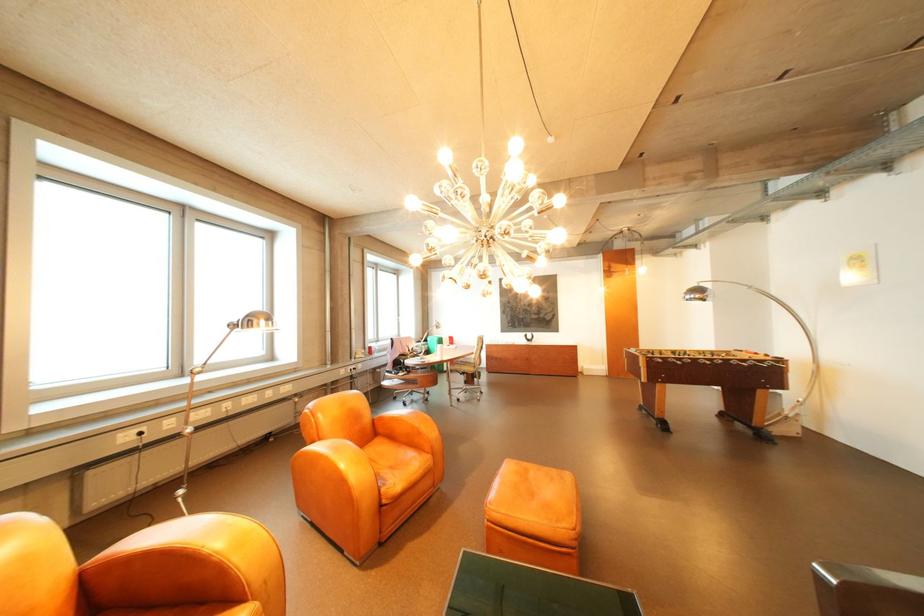
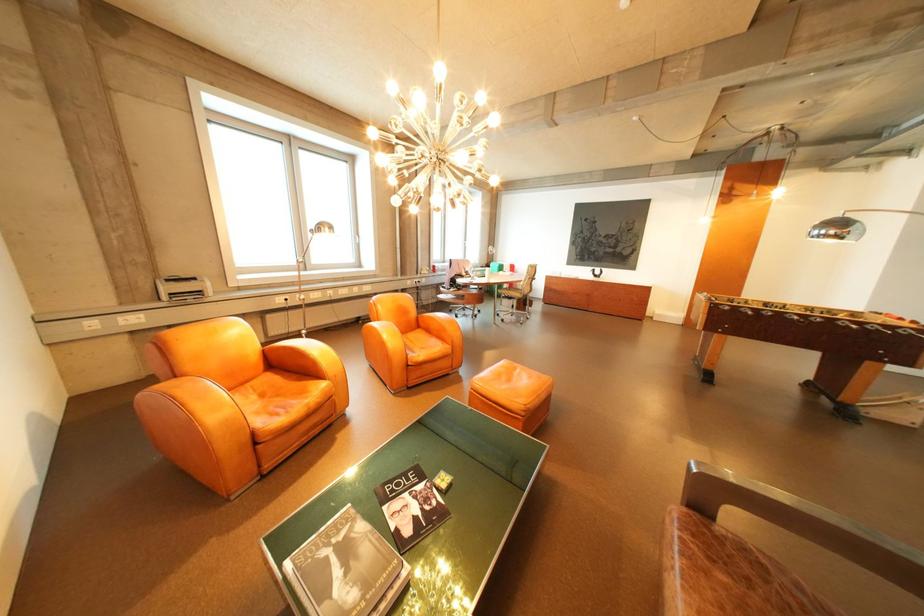
First-person continuous shooting, in which direction is the camera rotating?

The camera rotated toward left-down.